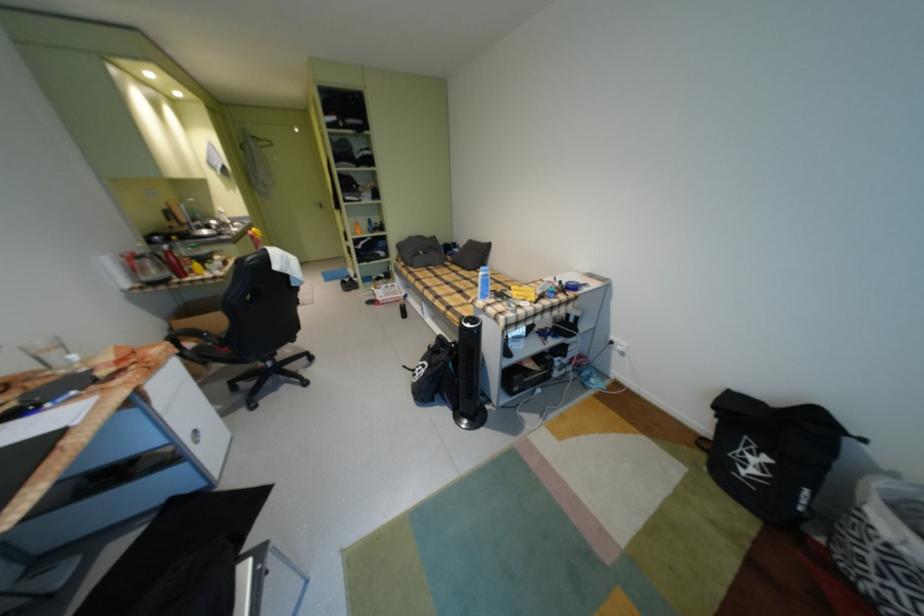
Where would you pull the silver door handle? Please return your answer as a coordinate pair (x, y).

(318, 205)